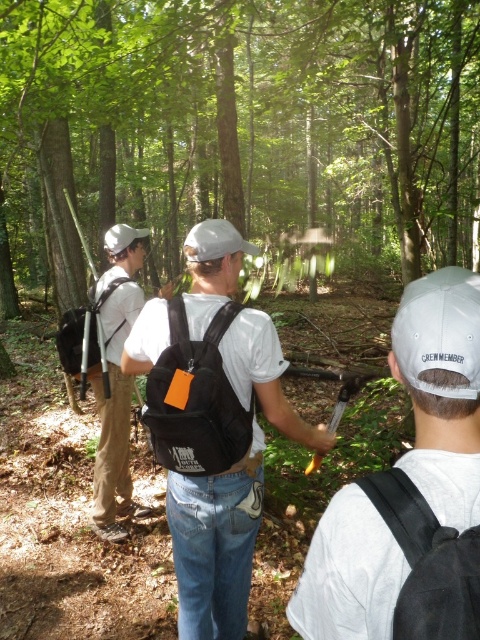
Question: Where is white matte baseball hat at center located in relation to white matte baseball hat at upper left in the image?

Choices:
 (A) right
 (B) left

Answer: (A)

Question: Which point is closer to the camera?

Choices:
 (A) matte black backpack at left
 (B) white matte baseball cap at center

Answer: (B)

Question: In this image, where is matte black backpack at left located relative to white matte baseball hat at upper left?

Choices:
 (A) above
 (B) below

Answer: (B)

Question: Is green leafy tree at center to the right of white matte baseball hat at upper left from the viewer's perspective?

Choices:
 (A) no
 (B) yes

Answer: (B)

Question: Estimate the real-world distances between objects in this image. Which object is closer to the white fabric cap at center?

Choices:
 (A) white matte baseball cap at center
 (B) black fabric backpack at center
 (C) green leafy tree at center
 (D) white matte baseball hat at upper left

Answer: (A)

Question: Which of the following is the closest to the observer?

Choices:
 (A) matte black backpack at left
 (B) white matte baseball hat at upper left

Answer: (A)